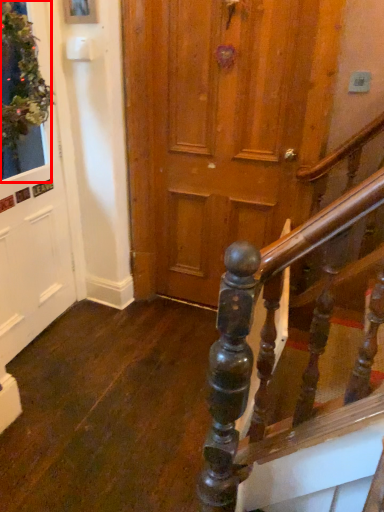
Question: From the image, what is the correct spatial relationship of window (annotated by the red box) in relation to door?

Choices:
 (A) left
 (B) right

Answer: (B)